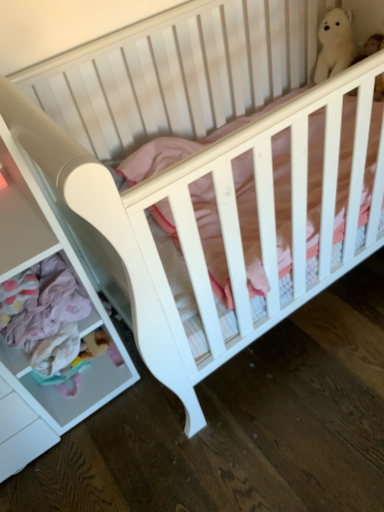
What are the coordinates of `white plastic drawer at lower left` in the screenshot? It's located at (22, 351).

Describe the element at coordinates (22, 351) in the screenshot. I see `white plastic drawer at lower left` at that location.

What is the approximate height of white plush bear at upper right?

The height of white plush bear at upper right is 11.52 inches.

At what (x,y) coordinates should I click in order to perform the action: click on white plush bear at upper right. Please return your answer as a coordinate pair (x, y). Looking at the image, I should click on (334, 44).

The height and width of the screenshot is (512, 384). What do you see at coordinates (334, 44) in the screenshot?
I see `white plush bear at upper right` at bounding box center [334, 44].

Where is `white plastic drawer at lower left`? Image resolution: width=384 pixels, height=512 pixels. white plastic drawer at lower left is located at coordinates (22, 351).

From the picture: Considering the relative positions of white plush bear at upper right and white plastic drawer at lower left in the image provided, is white plush bear at upper right to the left or to the right of white plastic drawer at lower left?

white plush bear at upper right is positioned on white plastic drawer at lower left's right side.

Considering the relative positions of white plush bear at upper right and white plastic drawer at lower left in the image provided, is white plush bear at upper right behind white plastic drawer at lower left?

Yes, white plush bear at upper right is behind white plastic drawer at lower left.

Which point is more distant from viewer, (x=330, y=49) or (x=54, y=249)?

Positioned behind is point (x=330, y=49).

From the image's perspective, which object appears higher, white plush bear at upper right or white plastic drawer at lower left?

white plush bear at upper right appears higher in the image.

From a real-world perspective, is white plush bear at upper right located higher than white plastic drawer at lower left?

Yes, from a real-world perspective, white plush bear at upper right is on top of white plastic drawer at lower left.

Considering the relative sizes of white plush bear at upper right and white plastic drawer at lower left in the image provided, is white plush bear at upper right thinner than white plastic drawer at lower left?

Yes.

Considering the sizes of white plush bear at upper right and white plastic drawer at lower left in the image, is white plush bear at upper right taller or shorter than white plastic drawer at lower left?

Clearly, white plush bear at upper right is shorter compared to white plastic drawer at lower left.

Looking at the image, does white plush bear at upper right seem bigger or smaller compared to white plastic drawer at lower left?

Considering their sizes, white plush bear at upper right takes up less space than white plastic drawer at lower left.

Is white plastic drawer at lower left inside white plush bear at upper right?

That's incorrect, white plastic drawer at lower left is not inside white plush bear at upper right.

Are white plush bear at upper right and white plastic drawer at lower left making contact?

No, white plush bear at upper right is not beside white plastic drawer at lower left.

In the scene shown: Is white plush bear at upper right turned away from white plastic drawer at lower left?

That's not correct — white plush bear at upper right is not looking away from white plastic drawer at lower left.

I want to click on dresser on the left of white plush bear at upper right, so click(x=22, y=351).

Can you confirm if white plastic drawer at lower left is positioned to the left of white plush bear at upper right?

Correct, you'll find white plastic drawer at lower left to the left of white plush bear at upper right.

From the picture: Is white plastic drawer at lower left further to camera compared to white plush bear at upper right?

No, white plastic drawer at lower left is in front of white plush bear at upper right.

Which is farther, (35, 193) or (324, 27)?

Point (324, 27)

From the image's perspective, which is above, white plastic drawer at lower left or white plush bear at upper right?

white plush bear at upper right is shown above in the image.

From a real-world perspective, is white plastic drawer at lower left physically located above or below white plush bear at upper right?

From a real-world perspective, white plastic drawer at lower left is physically below white plush bear at upper right.

Considering the relative sizes of white plastic drawer at lower left and white plush bear at upper right in the image provided, is white plastic drawer at lower left wider than white plush bear at upper right?

Yes.

Who is shorter, white plastic drawer at lower left or white plush bear at upper right?

With less height is white plush bear at upper right.

Considering the relative sizes of white plastic drawer at lower left and white plush bear at upper right in the image provided, is white plastic drawer at lower left smaller than white plush bear at upper right?

Incorrect, white plastic drawer at lower left is not smaller in size than white plush bear at upper right.

Do you think white plastic drawer at lower left is within white plush bear at upper right, or outside of it?

white plastic drawer at lower left is spatially situated outside white plush bear at upper right.

Is the surface of white plastic drawer at lower left in direct contact with white plush bear at upper right?

No, white plastic drawer at lower left is not with white plush bear at upper right.

Is white plastic drawer at lower left oriented towards white plush bear at upper right?

No, white plastic drawer at lower left is not facing towards white plush bear at upper right.

Image resolution: width=384 pixels, height=512 pixels. I want to click on dresser that appears on the left of white plush bear at upper right, so click(22, 351).

Identify the location of figurine on the right of white plastic drawer at lower left. The height and width of the screenshot is (512, 384). click(334, 44).

Locate an element on the screen. The height and width of the screenshot is (512, 384). dresser below the white plush bear at upper right (from a real-world perspective) is located at coordinates (22, 351).